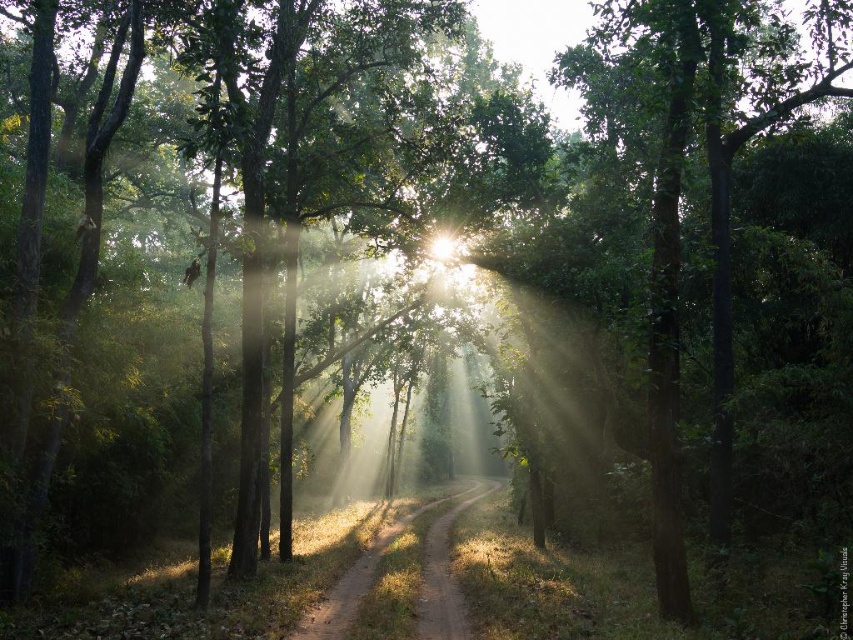
Question: Does brown dirt track at center appear on the left side of dirt/gravel path at center?

Choices:
 (A) no
 (B) yes

Answer: (B)

Question: Is dirt/gravel path at center positioned before bright white light at center?

Choices:
 (A) no
 (B) yes

Answer: (B)

Question: Which of the following is the farthest from the observer?

Choices:
 (A) coord(459,636)
 (B) coord(473,493)
 (C) coord(444,228)

Answer: (B)

Question: Which point is farther to the camera?

Choices:
 (A) (390, 540)
 (B) (437, 627)

Answer: (A)

Question: Which object is positioned closest to the brown dirt track at center?

Choices:
 (A) dirt/gravel path at center
 (B) bright white light at center

Answer: (A)

Question: Is dirt/gravel path at center thinner than bright white light at center?

Choices:
 (A) no
 (B) yes

Answer: (A)